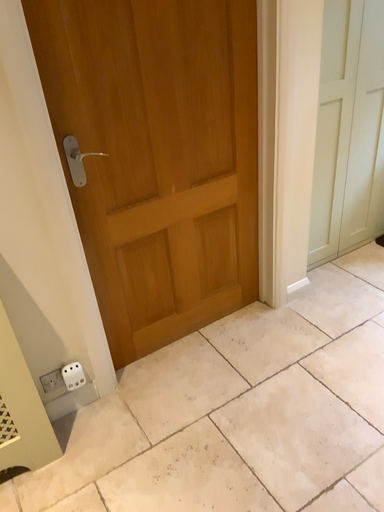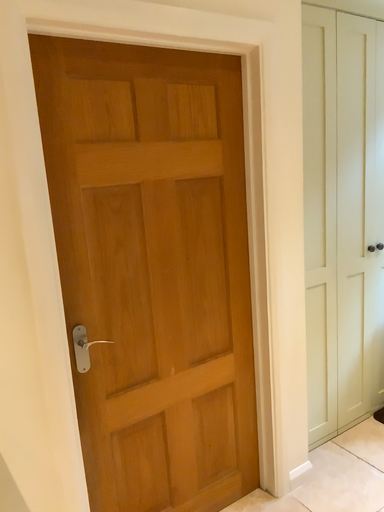
Question: How did the camera likely rotate when shooting the video?

Choices:
 (A) rotated downward
 (B) rotated upward

Answer: (B)